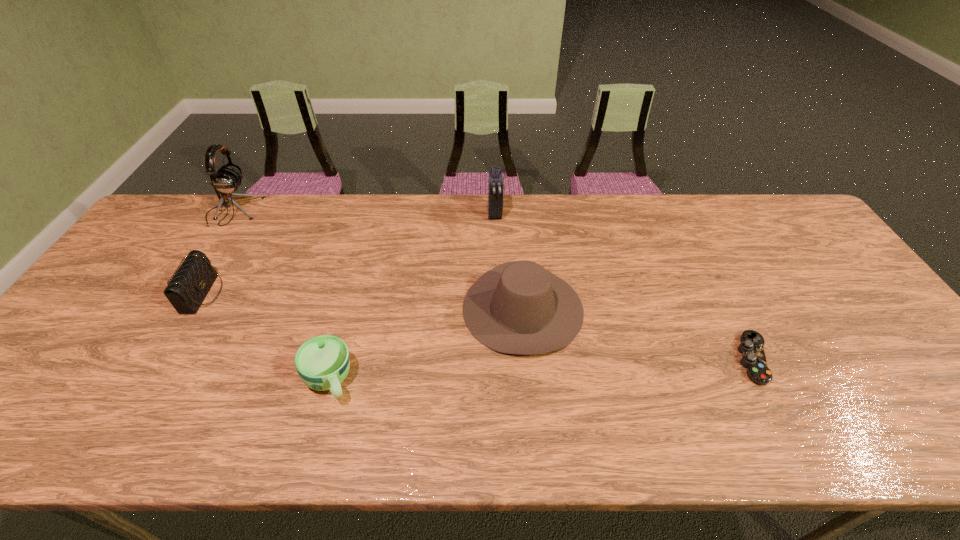
Where is `earphone`? The width and height of the screenshot is (960, 540). earphone is located at coordinates (227, 179).

The image size is (960, 540). Identify the location of the right clutch bag. (495, 181).

Where is `the taller clutch bag`? The width and height of the screenshot is (960, 540). the taller clutch bag is located at coordinates (495, 181).

Find the location of `cowboy hat`. cowboy hat is located at coordinates (519, 307).

In order to click on the left clutch bag in this screenshot , I will do `click(190, 284)`.

What are the coordinates of `the nearer clutch bag` in the screenshot? It's located at (190, 284).

Find the location of a particular element. This screenshot has height=540, width=960. cup is located at coordinates (322, 362).

This screenshot has height=540, width=960. Identify the location of the rightmost object. (751, 347).

Locate an element on the screen. This screenshot has width=960, height=540. the shortest object is located at coordinates (751, 347).

Find the location of `vacant space located on the front of the earphone`. vacant space located on the front of the earphone is located at coordinates pos(164,321).